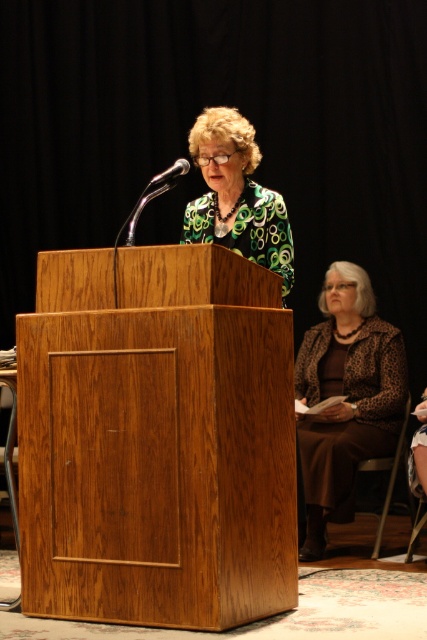
What are the coordinates of `green patterned blouse at center` in the screenshot? It's located at (236, 195).

Looking at this image, can you confirm if green patterned blouse at center is shorter than metallic silver microphone at upper left?

Incorrect, green patterned blouse at center's height does not fall short of metallic silver microphone at upper left's.

Is point (248, 189) behind point (164, 173)?

Yes, point (248, 189) is behind point (164, 173).

I want to click on green patterned blouse at center, so click(x=236, y=195).

Can you confirm if wooden podium at center is positioned to the right of brown fabric chair at lower right?

In fact, wooden podium at center is to the left of brown fabric chair at lower right.

Can you confirm if wooden podium at center is wider than brown fabric chair at lower right?

Correct, the width of wooden podium at center exceeds that of brown fabric chair at lower right.

Looking at this image, who is more forward, (102, 556) or (383, 468)?

Point (102, 556) is in front.

Find the location of a particular element. wooden podium at center is located at coordinates coord(157,440).

Is leopard print jacket at lower right positioned before brown fabric chair at lower right?

Yes.

The width and height of the screenshot is (427, 640). What are the coordinates of `leopard print jacket at lower right` in the screenshot? It's located at (347, 397).